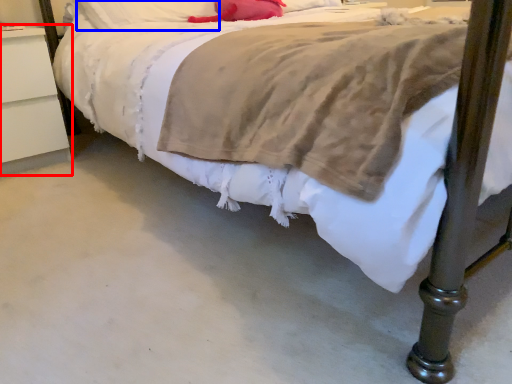
Question: Among these objects, which one is farthest to the camera, nightstand (highlighted by a red box) or pillow (highlighted by a blue box)?

Choices:
 (A) nightstand
 (B) pillow

Answer: (B)